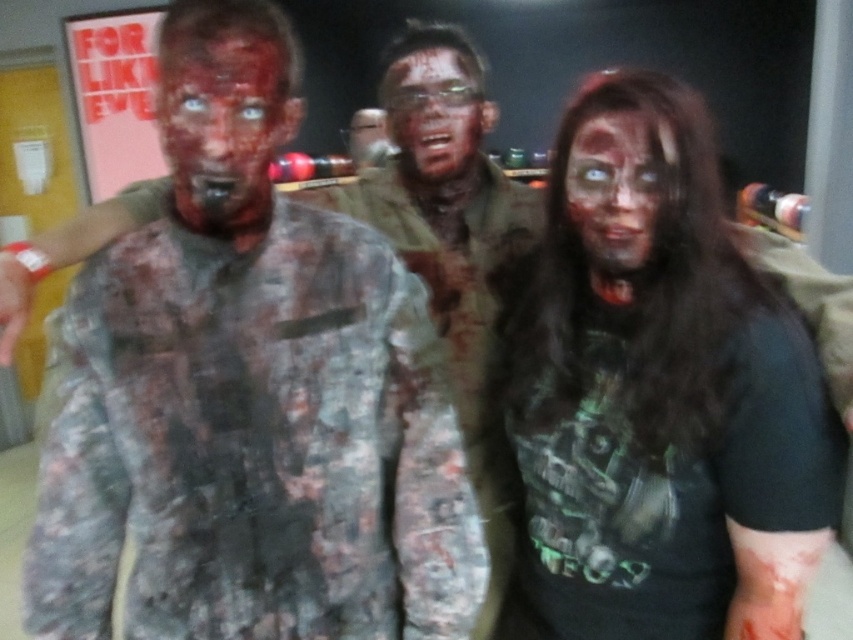
Is camouflage uniform at center taller than matte skin face at center?

Yes.

Does camouflage uniform at center come in front of matte skin face at center?

That is True.

Find the location of a particular element. The image size is (853, 640). camouflage uniform at center is located at coordinates click(248, 394).

Which of these two, camouflage uniform at center or blood-stained face at center, stands taller?

camouflage uniform at center is taller.

Which is above, camouflage uniform at center or blood-stained face at center?

blood-stained face at center is higher up.

Between point (293, 609) and point (393, 106), which one is positioned behind?

Positioned behind is point (393, 106).

Image resolution: width=853 pixels, height=640 pixels. Identify the location of camouflage uniform at center. (248, 394).

Is point (186, 83) less distant than point (407, 148)?

Yes, it is.

Who is more distant from viewer, [186,161] or [474,140]?

The point [474,140] is behind.

Image resolution: width=853 pixels, height=640 pixels. What do you see at coordinates (223, 129) in the screenshot?
I see `matte blood at center` at bounding box center [223, 129].

You are a GUI agent. You are given a task and a screenshot of the screen. Output one action in this format:
    pyautogui.click(x=<x>, y=<y>)
    Task: Click on the matte blood at center
    This screenshot has height=640, width=853.
    Given the screenshot: What is the action you would take?
    pyautogui.click(x=223, y=129)